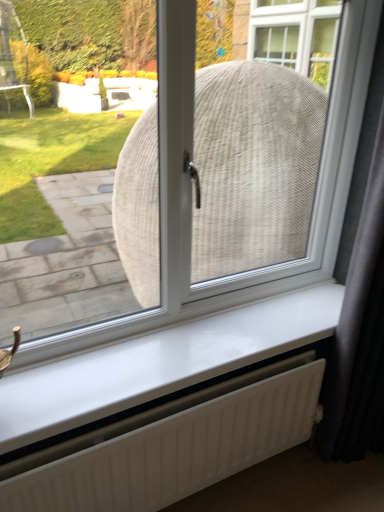
What is the approximate width of black fabric curtain at right?

black fabric curtain at right is 11.26 inches wide.

Locate an element on the screen. black fabric curtain at right is located at coordinates (359, 336).

Locate an element on the screen. white glossy window sill at center is located at coordinates (x=160, y=362).

Can you confirm if black fabric curtain at right is wider than white matte radiator at lower center?

Yes, black fabric curtain at right is wider than white matte radiator at lower center.

Can you tell me how much black fabric curtain at right and white matte radiator at lower center differ in facing direction?

They differ by 0.00363 degrees in their facing directions.

Is black fabric curtain at right placed right next to white matte radiator at lower center?

No, black fabric curtain at right is not in contact with white matte radiator at lower center.

From the image's perspective, is black fabric curtain at right above or below white matte radiator at lower center?

From the image's perspective, black fabric curtain at right appears above white matte radiator at lower center.

Considering the positions of objects black fabric curtain at right and white glossy window sill at center in the image provided, who is behind, black fabric curtain at right or white glossy window sill at center?

white glossy window sill at center.

From a real-world perspective, is black fabric curtain at right over white glossy window sill at center?

Yes, from a real-world perspective, black fabric curtain at right is above white glossy window sill at center.

Are black fabric curtain at right and white glossy window sill at center far apart?

No, black fabric curtain at right is not far away from white glossy window sill at center.

Considering the relative sizes of black fabric curtain at right and white glossy window sill at center in the image provided, is black fabric curtain at right thinner than white glossy window sill at center?

No.

How distant is white matte radiator at lower center from black fabric curtain at right?

white matte radiator at lower center and black fabric curtain at right are 17.90 inches apart.

From the image's perspective, would you say white matte radiator at lower center is shown under black fabric curtain at right?

Yes, from the image's perspective, white matte radiator at lower center is below black fabric curtain at right.

Is white matte radiator at lower center facing away from black fabric curtain at right?

No, white matte radiator at lower center is not facing away from black fabric curtain at right.

Based on the photo, from a real-world perspective, is white matte radiator at lower center physically located above or below black fabric curtain at right?

white matte radiator at lower center is below black fabric curtain at right.

Is the surface of white glossy window sill at center in direct contact with white matte radiator at lower center?

white glossy window sill at center is not next to white matte radiator at lower center, and they're not touching.

How far apart are white glossy window sill at center and white matte radiator at lower center?

They are 7.12 inches apart.

You are a GUI agent. You are given a task and a screenshot of the screen. Output one action in this format:
    pyautogui.click(x=<x>, y=<y>)
    Task: Click on the radiator below the white glossy window sill at center (from a real-world perspective)
    The height and width of the screenshot is (512, 384).
    Given the screenshot: What is the action you would take?
    pyautogui.click(x=171, y=445)

Which is in front, point (153, 372) or point (337, 327)?

Positioned in front is point (153, 372).

The height and width of the screenshot is (512, 384). In order to click on curtain in front of the white glossy window sill at center in this screenshot , I will do `click(359, 336)`.

Considering the relative sizes of white glossy window sill at center and black fabric curtain at right in the image provided, is white glossy window sill at center taller than black fabric curtain at right?

Incorrect, the height of white glossy window sill at center is not larger of that of black fabric curtain at right.

Considering the points (317, 408) and (56, 381), which point is behind, point (317, 408) or point (56, 381)?

The point (317, 408) is farther.

What are the coordinates of `radiator in front of the white glossy window sill at center` in the screenshot? It's located at (171, 445).

Could you tell me if white matte radiator at lower center is turned towards white glossy window sill at center?

No, white matte radiator at lower center is not oriented towards white glossy window sill at center.

The height and width of the screenshot is (512, 384). What are the coordinates of `curtain that is above the white matte radiator at lower center (from a real-world perspective)` in the screenshot? It's located at (359, 336).

This screenshot has height=512, width=384. Find the location of `curtain that is on the right side of white glossy window sill at center`. curtain that is on the right side of white glossy window sill at center is located at coordinates (359, 336).

When comparing their distances from white glossy window sill at center, does black fabric curtain at right or white matte radiator at lower center seem further?

black fabric curtain at right is positioned further to the anchor white glossy window sill at center.

When comparing their distances from black fabric curtain at right, does white glossy window sill at center or white matte radiator at lower center seem further?

white matte radiator at lower center.

Estimate the real-world distances between objects in this image. Which object is further from white matte radiator at lower center, white glossy window sill at center or black fabric curtain at right?

Among the two, black fabric curtain at right is located further to white matte radiator at lower center.

Based on their spatial positions, is black fabric curtain at right or white glossy window sill at center closer to white matte radiator at lower center?

Based on the image, white glossy window sill at center appears to be nearer to white matte radiator at lower center.

Which object lies further to the anchor point white glossy window sill at center, white matte radiator at lower center or black fabric curtain at right?

black fabric curtain at right is positioned further to the anchor white glossy window sill at center.

Estimate the real-world distances between objects in this image. Which object is further from black fabric curtain at right, white matte radiator at lower center or white glossy window sill at center?

white matte radiator at lower center.

Find the location of `radiator between white glossy window sill at center and black fabric curtain at right in the horizontal direction`. radiator between white glossy window sill at center and black fabric curtain at right in the horizontal direction is located at coordinates (171, 445).